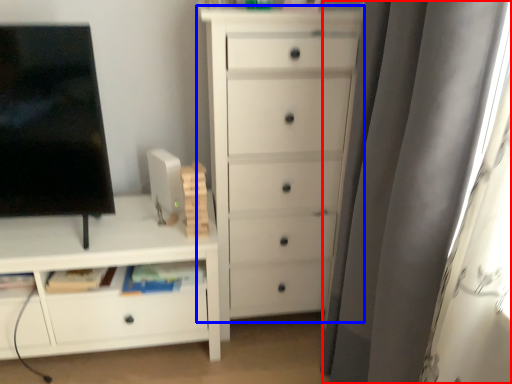
Question: Which of the following is the farthest to the observer, curtain (highlighted by a red box) or chest of drawers (highlighted by a blue box)?

Choices:
 (A) curtain
 (B) chest of drawers

Answer: (B)